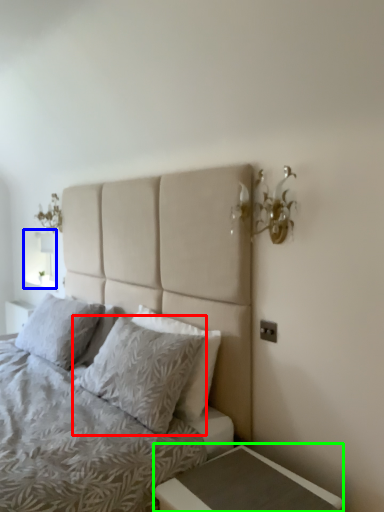
Question: Estimate the real-world distances between objects in this image. Which object is closer to pillow (highlighted by a red box), window screen (highlighted by a blue box) or nightstand (highlighted by a green box)?

Choices:
 (A) window screen
 (B) nightstand

Answer: (B)